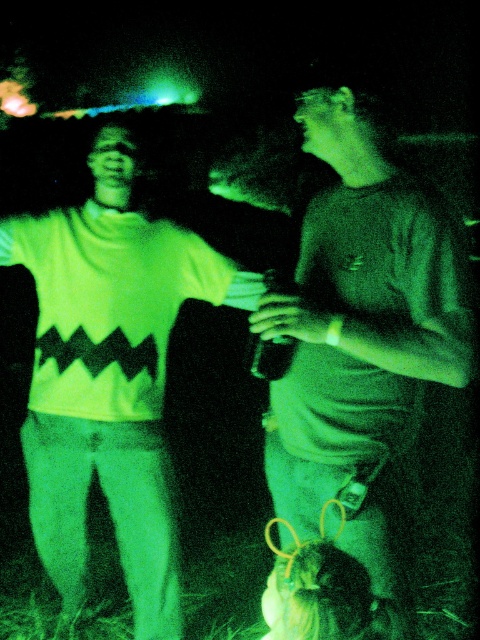
Question: Which object appears closest to the camera in this image?

Choices:
 (A) matte gray t-shirt at right
 (B) white matte sweater at left

Answer: (A)

Question: Does matte gray t-shirt at right have a greater width compared to white matte sweater at left?

Choices:
 (A) no
 (B) yes

Answer: (A)

Question: Does matte gray t-shirt at right have a greater width compared to white matte sweater at left?

Choices:
 (A) yes
 (B) no

Answer: (B)

Question: Does matte gray t-shirt at right appear on the right side of white matte sweater at left?

Choices:
 (A) no
 (B) yes

Answer: (B)

Question: Which object appears farthest from the camera in this image?

Choices:
 (A) matte gray t-shirt at right
 (B) white matte sweater at left

Answer: (B)

Question: Which object appears closest to the camera in this image?

Choices:
 (A) white matte sweater at left
 (B) matte gray t-shirt at right

Answer: (B)